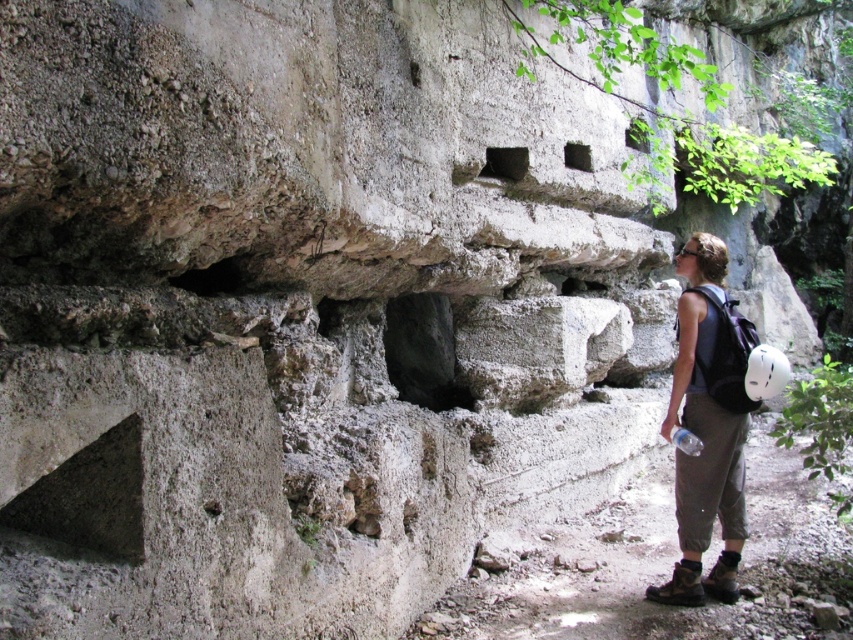
You are standing in the scene and want to place your dark gray fabric backpack at right on the ground near the rock formation. Based on its current position, is it already placed near the rock formation?

The dark gray fabric backpack at right is located at point (706, 429), which is near the rock formation, so yes, it is already placed near the rock formation.